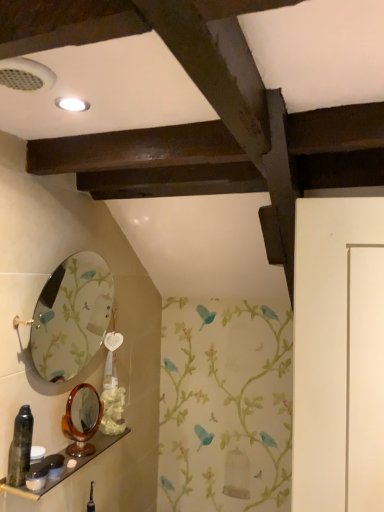
Describe the element at coordinates (82, 419) in the screenshot. I see `brown glossy mirror at center, the 2th mirror positioned from the top` at that location.

What do you see at coordinates (71, 316) in the screenshot? I see `oval glass mirror at upper left, placed as the 2th mirror when sorted from bottom to top` at bounding box center [71, 316].

This screenshot has height=512, width=384. I want to click on matte black spray can at lower left, so click(20, 447).

I want to click on brown glossy mirror at center, the first mirror when ordered from bottom to top, so click(x=82, y=419).

Is matte black spray can at lower left at the back of oval glass mirror at upper left, placed as the 2th mirror when sorted from bottom to top?

No, oval glass mirror at upper left, placed as the 2th mirror when sorted from bottom to top, is not facing the opposite direction of matte black spray can at lower left.

Is point (87, 301) closer or farther from the camera than point (8, 461)?

Point (87, 301) appears to be farther away from the viewer than point (8, 461).

Are oval glass mirror at upper left, which is counted as the first mirror, starting from the top, and matte black spray can at lower left far apart?

No, oval glass mirror at upper left, which is counted as the first mirror, starting from the top, is not far from matte black spray can at lower left.

This screenshot has height=512, width=384. In order to click on shelf beneath the brown glossy mirror at center, the 2th mirror positioned from the top (from a real-world perspective) in this screenshot , I will do `click(66, 467)`.

Is wooden shelf at lower left not within brown glossy mirror at center, the 2th mirror positioned from the top?

That's correct, wooden shelf at lower left is outside of brown glossy mirror at center, the 2th mirror positioned from the top.

Between point (124, 432) and point (65, 430), which one is positioned behind?

The point (124, 432) is more distant.

Would you say wooden shelf at lower left is a long distance from brown glossy mirror at center, the first mirror when ordered from bottom to top?

wooden shelf at lower left is near brown glossy mirror at center, the first mirror when ordered from bottom to top, not far away.

From the image's perspective, which object appears higher, wooden shelf at lower left or matte black container at lower left?

matte black container at lower left appears higher in the image.

Considering the relative sizes of wooden shelf at lower left and matte black container at lower left in the image provided, is wooden shelf at lower left thinner than matte black container at lower left?

In fact, wooden shelf at lower left might be wider than matte black container at lower left.

Choose the correct answer: Is wooden shelf at lower left inside matte black container at lower left or outside it?

wooden shelf at lower left lies outside matte black container at lower left.

Is wooden shelf at lower left facing towards matte black container at lower left?

No, wooden shelf at lower left does not turn towards matte black container at lower left.

Considering the positions of objects matte black container at lower left and matte black spray can at lower left in the image provided, who is more to the left, matte black container at lower left or matte black spray can at lower left?

From the viewer's perspective, matte black spray can at lower left appears more on the left side.

How distant is matte black container at lower left from matte black spray can at lower left?

9.02 inches.

Which is in front, matte black container at lower left or matte black spray can at lower left?

matte black spray can at lower left.

Based on the photo, from a real-world perspective, which object rests below the other?

In real-world perspective, matte black container at lower left is lower.

From the image's perspective, would you say wooden shelf at lower left is shown under matte black spray can at lower left?

Yes.

Looking at this image, considering the sizes of objects wooden shelf at lower left and matte black spray can at lower left in the image provided, who is shorter, wooden shelf at lower left or matte black spray can at lower left?

wooden shelf at lower left.

Is the depth of wooden shelf at lower left less than that of matte black spray can at lower left?

Yes, wooden shelf at lower left is closer to the camera.

Would you say wooden shelf at lower left is to the left or to the right of matte black spray can at lower left in the picture?

In the image, wooden shelf at lower left appears on the right side of matte black spray can at lower left.

Locate an element on the screen. mirror behind the oval glass mirror at upper left, placed as the 2th mirror when sorted from bottom to top is located at coordinates (82, 419).

From the image's perspective, does brown glossy mirror at center, the 2th mirror positioned from the top, appear lower than oval glass mirror at upper left, which is counted as the first mirror, starting from the top?

Yes.

Which of these two, brown glossy mirror at center, the first mirror when ordered from bottom to top, or oval glass mirror at upper left, placed as the 2th mirror when sorted from bottom to top, is thinner?

brown glossy mirror at center, the first mirror when ordered from bottom to top.

Looking at this image, do you think wooden shelf at lower left is within oval glass mirror at upper left, which is counted as the first mirror, starting from the top, or outside of it?

wooden shelf at lower left lies outside oval glass mirror at upper left, which is counted as the first mirror, starting from the top.

Which of these two, wooden shelf at lower left or oval glass mirror at upper left, which is counted as the first mirror, starting from the top, is wider?

Wider between the two is wooden shelf at lower left.

At what (x,y) coordinates should I click in order to perform the action: click on bottle in front of the oval glass mirror at upper left, which is counted as the first mirror, starting from the top. Please return your answer as a coordinate pair (x, y). The height and width of the screenshot is (512, 384). Looking at the image, I should click on pos(20,447).

The height and width of the screenshot is (512, 384). I want to click on mirror that is the 1st one above the wooden shelf at lower left (from a real-world perspective), so click(x=82, y=419).

Looking at the image, which one is located further to matte black container at lower left, matte black spray can at lower left or oval glass mirror at upper left, placed as the 2th mirror when sorted from bottom to top?

oval glass mirror at upper left, placed as the 2th mirror when sorted from bottom to top.

Based on their spatial positions, is brown glossy mirror at center, the first mirror when ordered from bottom to top, or matte black container at lower left further from wooden shelf at lower left?

matte black container at lower left.

Based on their spatial positions, is oval glass mirror at upper left, which is counted as the first mirror, starting from the top, or brown glossy mirror at center, the first mirror when ordered from bottom to top, further from matte black spray can at lower left?

oval glass mirror at upper left, which is counted as the first mirror, starting from the top, is further to matte black spray can at lower left.

When comparing their distances from wooden shelf at lower left, does matte black spray can at lower left or brown glossy mirror at center, the 2th mirror positioned from the top, seem closer?

The object closer to wooden shelf at lower left is brown glossy mirror at center, the 2th mirror positioned from the top.

Based on their spatial positions, is brown glossy mirror at center, the 2th mirror positioned from the top, or oval glass mirror at upper left, placed as the 2th mirror when sorted from bottom to top, further from matte black spray can at lower left?

oval glass mirror at upper left, placed as the 2th mirror when sorted from bottom to top, lies further to matte black spray can at lower left than the other object.

Considering their positions, is matte black container at lower left positioned further to brown glossy mirror at center, the 2th mirror positioned from the top, than oval glass mirror at upper left, placed as the 2th mirror when sorted from bottom to top?

oval glass mirror at upper left, placed as the 2th mirror when sorted from bottom to top, is further to brown glossy mirror at center, the 2th mirror positioned from the top.

Which object lies nearer to the anchor point matte black spray can at lower left, matte black container at lower left or brown glossy mirror at center, the first mirror when ordered from bottom to top?

The object closer to matte black spray can at lower left is matte black container at lower left.

Estimate the real-world distances between objects in this image. Which object is further from matte black container at lower left, brown glossy mirror at center, the 2th mirror positioned from the top, or wooden shelf at lower left?

brown glossy mirror at center, the 2th mirror positioned from the top.

Where is `bottle that lies between oval glass mirror at upper left, which is counted as the first mirror, starting from the top, and matte black container at lower left from top to bottom`? bottle that lies between oval glass mirror at upper left, which is counted as the first mirror, starting from the top, and matte black container at lower left from top to bottom is located at coordinates (20, 447).

This screenshot has height=512, width=384. In order to click on bottle between oval glass mirror at upper left, placed as the 2th mirror when sorted from bottom to top, and wooden shelf at lower left in the up-down direction in this screenshot , I will do `click(20, 447)`.

You are a GUI agent. You are given a task and a screenshot of the screen. Output one action in this format:
    pyautogui.click(x=<x>, y=<y>)
    Task: Click on the toiletry located between wooden shelf at lower left and brown glossy mirror at center, the 2th mirror positioned from the top, in the depth direction
    The height and width of the screenshot is (512, 384).
    Given the screenshot: What is the action you would take?
    pyautogui.click(x=54, y=465)

Find the location of a particular element. The image size is (384, 512). bottle that lies between oval glass mirror at upper left, which is counted as the first mirror, starting from the top, and brown glossy mirror at center, the 2th mirror positioned from the top, from top to bottom is located at coordinates (20, 447).